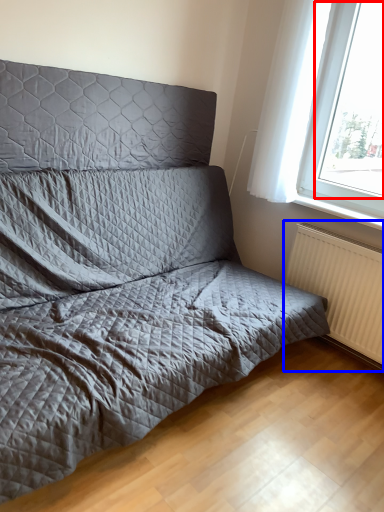
Question: Which object is further to the camera taking this photo, window screen (highlighted by a red box) or radiator (highlighted by a blue box)?

Choices:
 (A) window screen
 (B) radiator

Answer: (B)